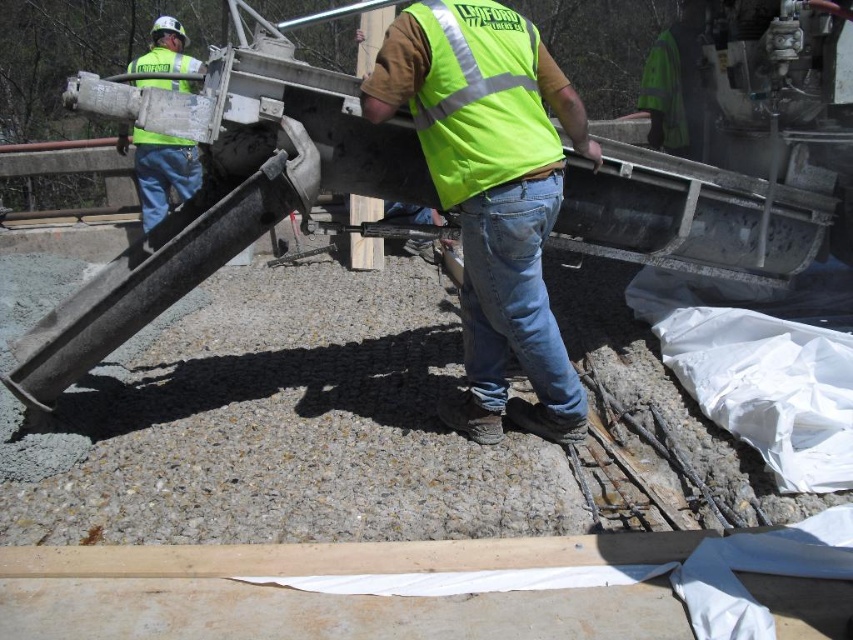
Between point (447, 176) and point (451, 93), which one is positioned behind?

Point (447, 176)

Is point (463, 236) behind point (560, 144)?

No, (463, 236) is in front of (560, 144).

Is point (543, 218) farther from camera compared to point (483, 182)?

Yes.

In order to click on high visibility vest at center in this screenshot , I will do `click(491, 193)`.

Is high-visibility yellow-green fabric safety vest at center wider than green reflective vest at upper left?

Yes, high-visibility yellow-green fabric safety vest at center is wider than green reflective vest at upper left.

Is point (543, 65) farther from viewer compared to point (180, 168)?

No, it is in front of (180, 168).

The height and width of the screenshot is (640, 853). What are the coordinates of `high-visibility yellow-green fabric safety vest at center` in the screenshot? It's located at coord(479,97).

Who is lower down, high visibility vest at center or green reflective vest at upper left?

high visibility vest at center is below.

Is high visibility vest at center wider than green reflective vest at upper left?

Yes, high visibility vest at center is wider than green reflective vest at upper left.

Find the location of a particular element. This screenshot has width=853, height=640. high visibility vest at center is located at coordinates (491, 193).